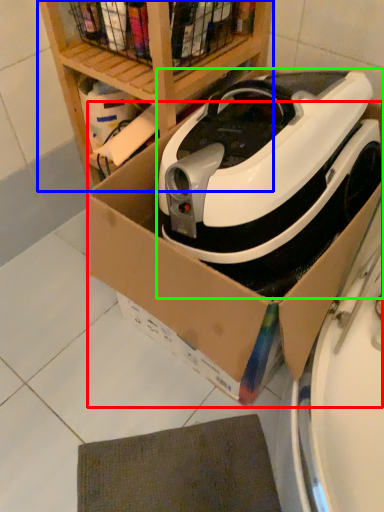
Question: Considering the real-world distances, which object is closest to cardboard box (highlighted by a red box)? shelf (highlighted by a blue box) or home appliance (highlighted by a green box).

Choices:
 (A) shelf
 (B) home appliance

Answer: (B)